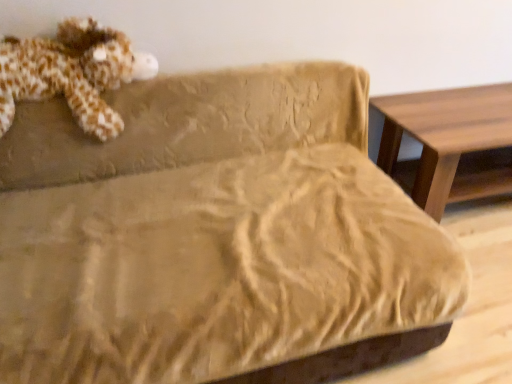
Question: Considering the positions of fluffy brown plush at upper left and wooden table at right in the image, is fluffy brown plush at upper left taller or shorter than wooden table at right?

Choices:
 (A) tall
 (B) short

Answer: (A)

Question: Would you say fluffy brown plush at upper left is to the left or to the right of wooden table at right in the picture?

Choices:
 (A) right
 (B) left

Answer: (B)

Question: Considering the positions of fluffy brown plush at upper left and wooden table at right in the image, is fluffy brown plush at upper left wider or thinner than wooden table at right?

Choices:
 (A) wide
 (B) thin

Answer: (B)

Question: In terms of width, does wooden table at right look wider or thinner when compared to fluffy brown plush at upper left?

Choices:
 (A) wide
 (B) thin

Answer: (A)

Question: Is wooden table at right to the left or to the right of fluffy brown plush at upper left in the image?

Choices:
 (A) left
 (B) right

Answer: (B)

Question: Relative to fluffy brown plush at upper left, is wooden table at right in front or behind?

Choices:
 (A) front
 (B) behind

Answer: (B)

Question: Is wooden table at right situated inside fluffy brown plush at upper left or outside?

Choices:
 (A) outside
 (B) inside

Answer: (A)